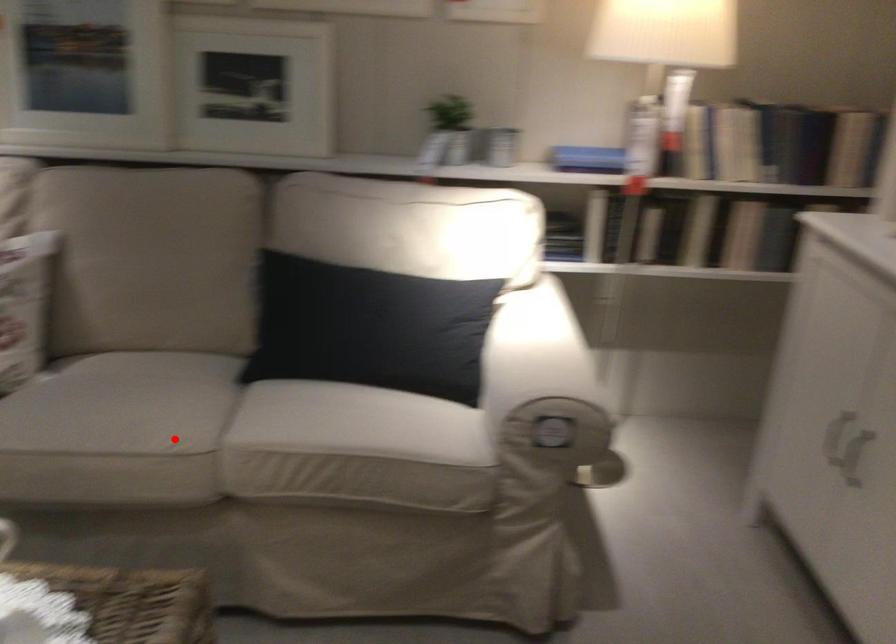
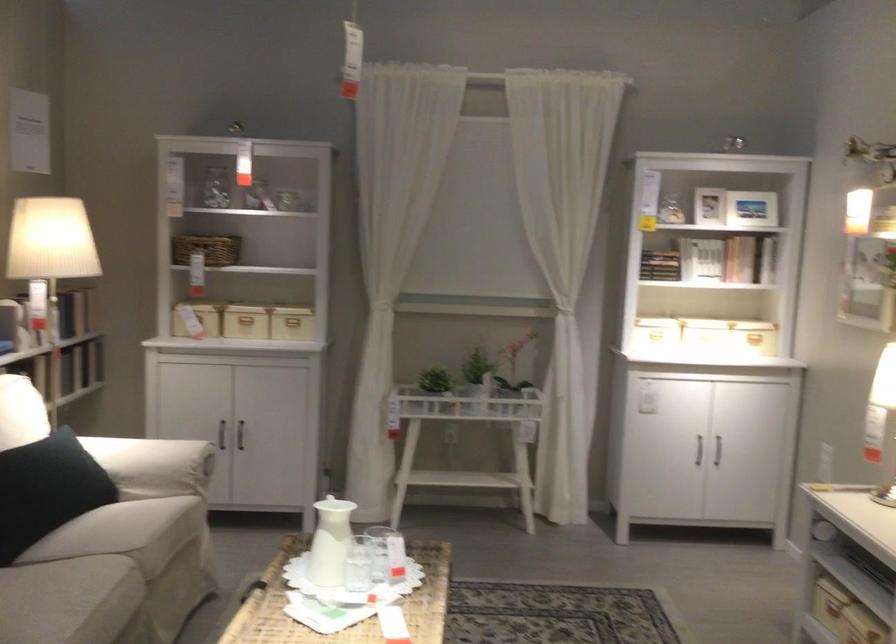
Question: I am providing you with two images of the same scene from different viewpoints. In image1, a red point is highlighted. Considering the same 3D point in image2, which of the following is correct?

Choices:
 (A) It is closer
 (B) It is farther

Answer: (B)